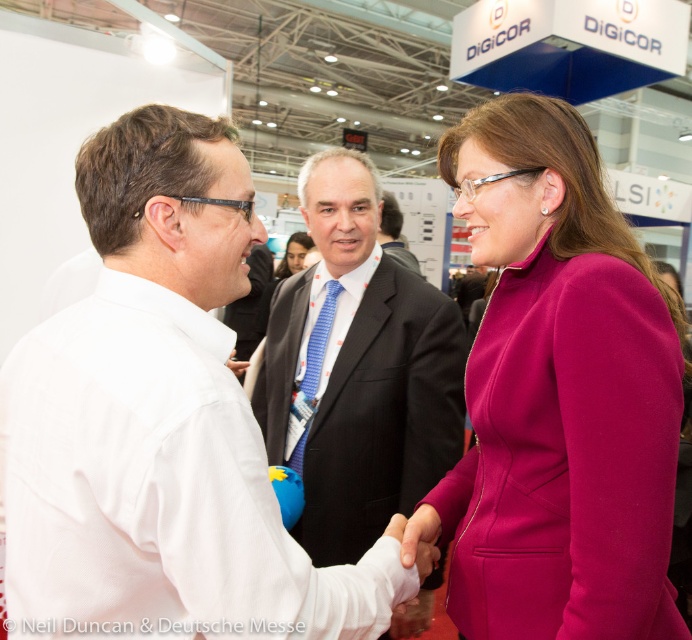
Question: Observing the image, what is the correct spatial positioning of white shirt at center in reference to fuchsia woolen suit at center?

Choices:
 (A) above
 (B) below

Answer: (B)

Question: Considering the real-world distances, which object is closest to the dark suit at center?

Choices:
 (A) fuchsia woolen suit at center
 (B) white shirt at center

Answer: (A)

Question: Which object is positioned farthest from the blue striped tie at center?

Choices:
 (A) fuchsia woolen suit at center
 (B) white shirt at center
 (C) dark suit at center

Answer: (C)

Question: Does fuchsia woolen suit at center have a larger size compared to blue striped tie at center?

Choices:
 (A) no
 (B) yes

Answer: (A)

Question: Is fuchsia woolen suit at center behind blue striped tie at center?

Choices:
 (A) no
 (B) yes

Answer: (A)

Question: Which point is farther to the camera?

Choices:
 (A) dark suit at center
 (B) fuchsia woolen suit at center
 (C) blue striped tie at center

Answer: (A)